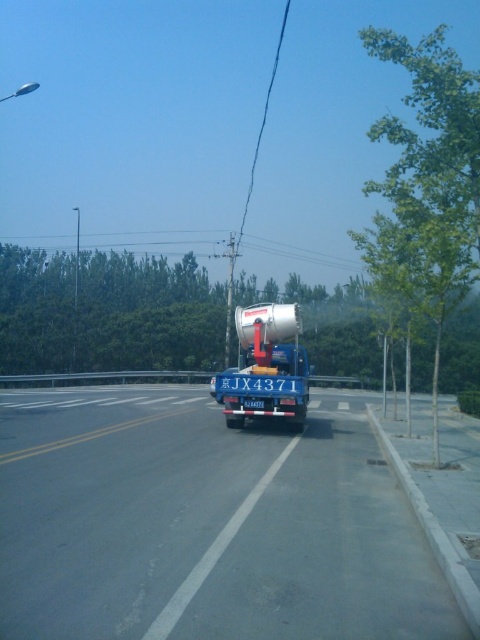
You are a pedestrian standing on the sidewalk to the right of the road. You see the blue metallic truck at center and the silver metallic trailer truck at center. Which truck is closer to your position?

The blue metallic truck at center is positioned on the left side of the silver metallic trailer truck at center. Since you are on the sidewalk to the right of the road, the silver metallic trailer truck at center is closer to your position.

You are a traffic officer observing the road scene. You notice the blue metallic truck at center and the silver metallic trailer truck at center. Which vehicle occupies more space in the road?

The blue metallic truck at center is bigger than the silver metallic trailer truck at center, so it occupies more space in the road.